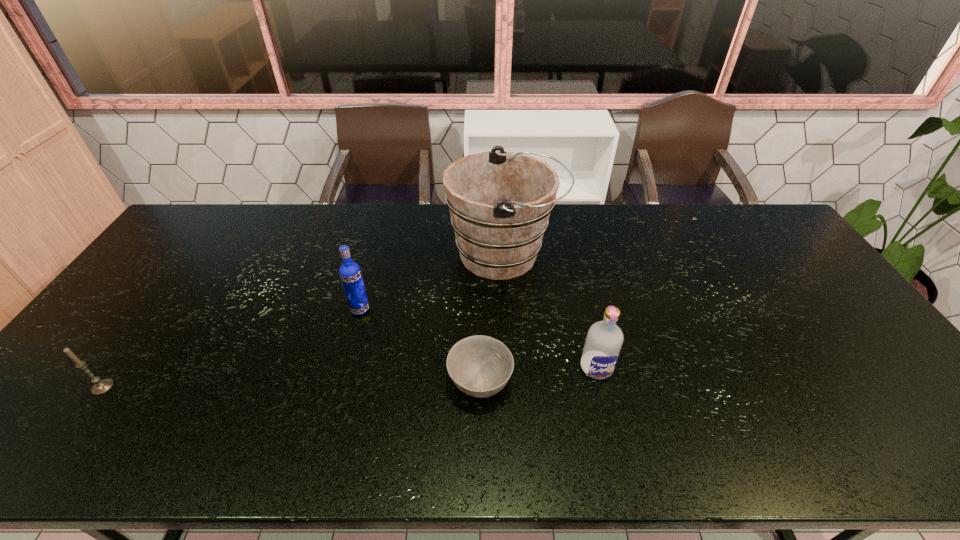
Find the location of a particular element. vacant space located 0.150m on the label of the right vodka is located at coordinates (613, 439).

Identify the location of vacant position located 0.300m on the right of the second shortest object. (234, 387).

Locate an element on the screen. This screenshot has width=960, height=540. vacant position located 0.330m on the left of the shortest object is located at coordinates (315, 384).

Where is `object at the far edge`? The image size is (960, 540). object at the far edge is located at coordinates (500, 202).

Locate an element on the screen. This screenshot has width=960, height=540. object located in the left edge section of the desktop is located at coordinates (100, 386).

In the image, there is a desktop. Where is `vacant space at the far edge`? The height and width of the screenshot is (540, 960). vacant space at the far edge is located at coordinates (351, 239).

Where is `free space at the near edge`? Image resolution: width=960 pixels, height=540 pixels. free space at the near edge is located at coordinates (819, 452).

Image resolution: width=960 pixels, height=540 pixels. Find the location of `vacant space at the left edge`. vacant space at the left edge is located at coordinates (125, 306).

Locate an element on the screen. This screenshot has height=540, width=960. vacant space at the right edge of the desktop is located at coordinates (886, 414).

Find the location of a particular element. This screenshot has height=540, width=960. free location at the far right corner is located at coordinates point(775,238).